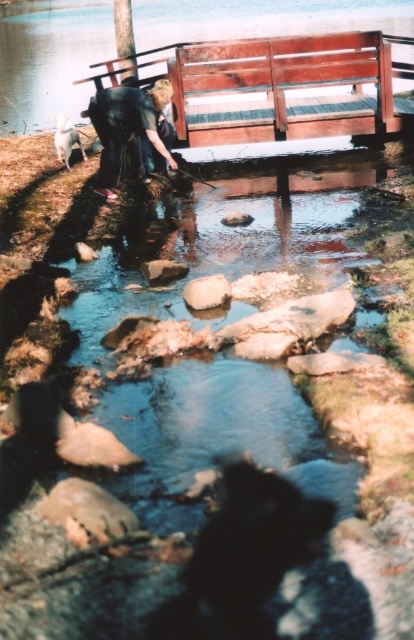
Is point (322, 1) more distant than point (221, 300)?

Yes, point (322, 1) is farther from viewer.

Which is in front, point (147, 28) or point (201, 296)?

Point (201, 296)

You are a GUI agent. You are given a task and a screenshot of the screen. Output one action in this format:
    pyautogui.click(x=<x>, y=<y>)
    Task: Click on the smooth wooden bench at upper center
    
    Given the screenshot: What is the action you would take?
    pyautogui.click(x=50, y=58)

Between point (43, 80) and point (389, 109), which one is positioned behind?

Point (43, 80)

Can you confirm if smooth wooden bench at upper center is smaller than wooden bench at upper center?

Incorrect, smooth wooden bench at upper center is not smaller in size than wooden bench at upper center.

Which is in front, point (319, 20) or point (380, 106)?

Point (380, 106)

At what (x,y) coordinates should I click in order to perform the action: click on smooth wooden bench at upper center. Please return your answer as a coordinate pair (x, y). Looking at the image, I should click on (50, 58).

Between dark blue fabric at center and white smooth rock at center, which one has less height?

white smooth rock at center is shorter.

Is dark blue fabric at center to the left of white smooth rock at center from the viewer's perspective?

Correct, you'll find dark blue fabric at center to the left of white smooth rock at center.

At what (x,y) coordinates should I click in order to perform the action: click on dark blue fabric at center. Please return your answer as a coordinate pair (x, y). Looking at the image, I should click on (127, 128).